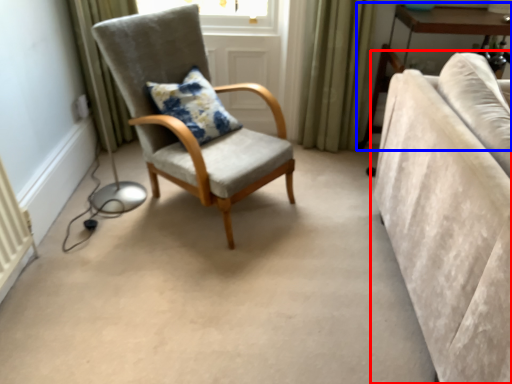
Question: Which of the following is the farthest to the observer, studio couch (highlighted by a red box) or table (highlighted by a blue box)?

Choices:
 (A) studio couch
 (B) table

Answer: (B)